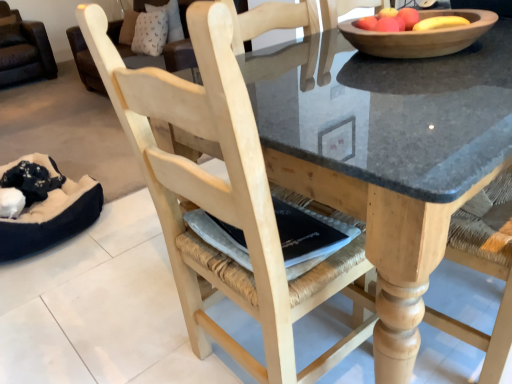
Question: Is black plush bean bag at lower left not close to natural wood chair at center?

Choices:
 (A) yes
 (B) no

Answer: (A)

Question: From the image's perspective, is black plush bean bag at lower left located beneath natural wood chair at center?

Choices:
 (A) yes
 (B) no

Answer: (B)

Question: From the image's perspective, would you say black plush bean bag at lower left is positioned over natural wood chair at center?

Choices:
 (A) no
 (B) yes

Answer: (B)

Question: Considering the relative positions of black plush bean bag at lower left and natural wood chair at center in the image provided, is black plush bean bag at lower left to the right of natural wood chair at center from the viewer's perspective?

Choices:
 (A) yes
 (B) no

Answer: (B)

Question: Is black plush bean bag at lower left in front of natural wood chair at center?

Choices:
 (A) yes
 (B) no

Answer: (B)

Question: Is black plush bean bag at lower left smaller than natural wood chair at center?

Choices:
 (A) no
 (B) yes

Answer: (B)

Question: Can we say wooden bowl at upper center lies outside black plush bean bag at lower left?

Choices:
 (A) yes
 (B) no

Answer: (A)

Question: Considering the relative positions of wooden bowl at upper center and black plush bean bag at lower left in the image provided, is wooden bowl at upper center to the left of black plush bean bag at lower left from the viewer's perspective?

Choices:
 (A) yes
 (B) no

Answer: (B)

Question: Is wooden bowl at upper center positioned in front of black plush bean bag at lower left?

Choices:
 (A) no
 (B) yes

Answer: (B)

Question: Considering the relative positions of wooden bowl at upper center and black plush bean bag at lower left in the image provided, is wooden bowl at upper center to the right of black plush bean bag at lower left from the viewer's perspective?

Choices:
 (A) yes
 (B) no

Answer: (A)

Question: From the image's perspective, is wooden bowl at upper center below black plush bean bag at lower left?

Choices:
 (A) no
 (B) yes

Answer: (A)

Question: Does wooden bowl at upper center come behind black plush bean bag at lower left?

Choices:
 (A) yes
 (B) no

Answer: (B)

Question: Does wooden bowl at upper center have a lesser width compared to natural wood chair at center?

Choices:
 (A) no
 (B) yes

Answer: (B)